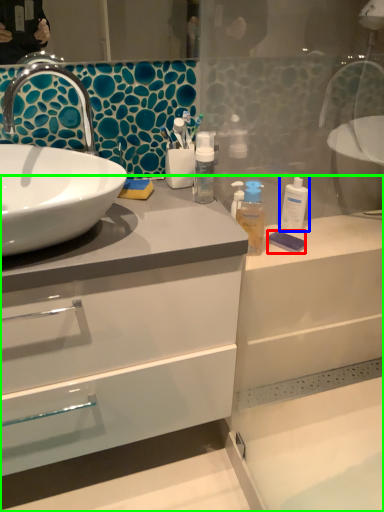
Question: Which object is the closest to the soap (highlighted by a red box)? Choose among these: mouthwash (highlighted by a blue box) or bathroom cabinet (highlighted by a green box).

Choices:
 (A) mouthwash
 (B) bathroom cabinet

Answer: (A)